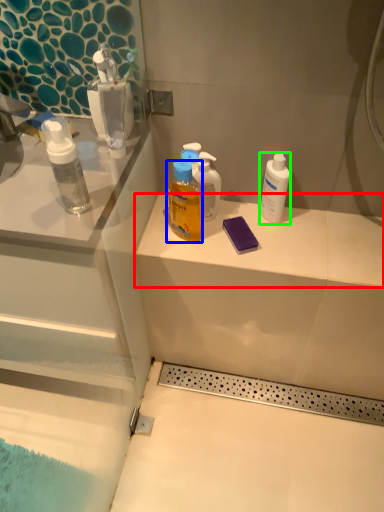
Question: Which object is the closest to the counter top (highlighted by a red box)? Choose among these: bottle (highlighted by a blue box) or mouthwash (highlighted by a green box).

Choices:
 (A) bottle
 (B) mouthwash

Answer: (B)